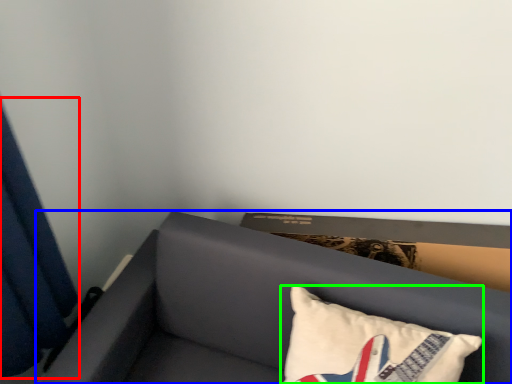
Question: Considering the real-world distances, which object is farthest from curtain (highlighted by a red box)? furniture (highlighted by a blue box) or pillow (highlighted by a green box)?

Choices:
 (A) furniture
 (B) pillow

Answer: (B)